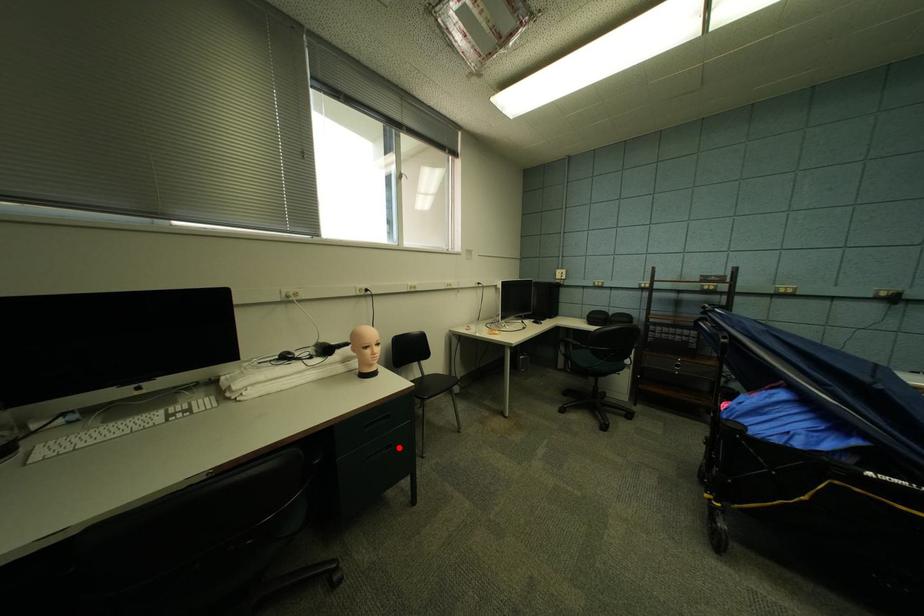
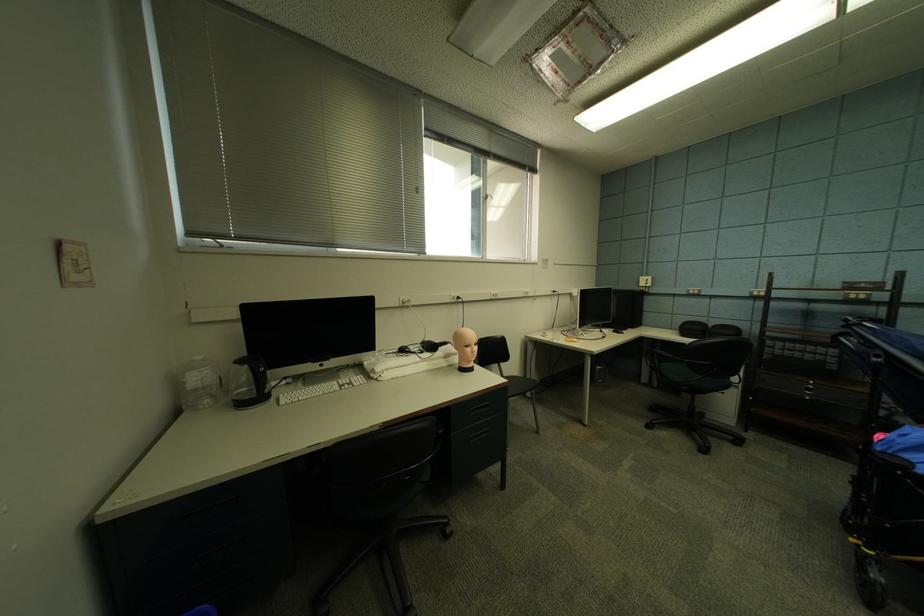
Where in the second image is the point corresponding to the highlighted location from the first image?

(495, 432)